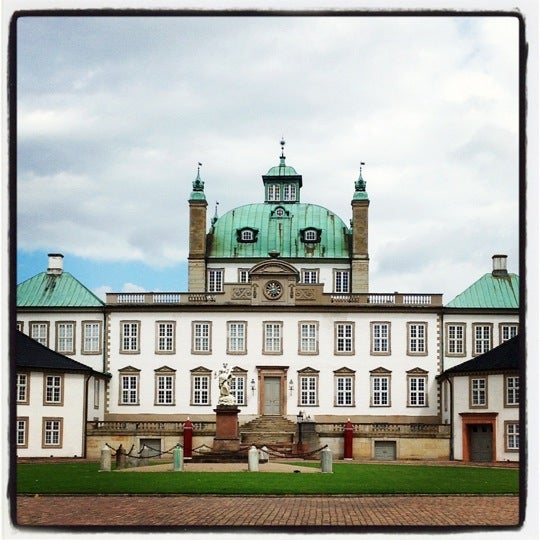
This screenshot has width=540, height=540. I want to click on stairs, so click(269, 424).